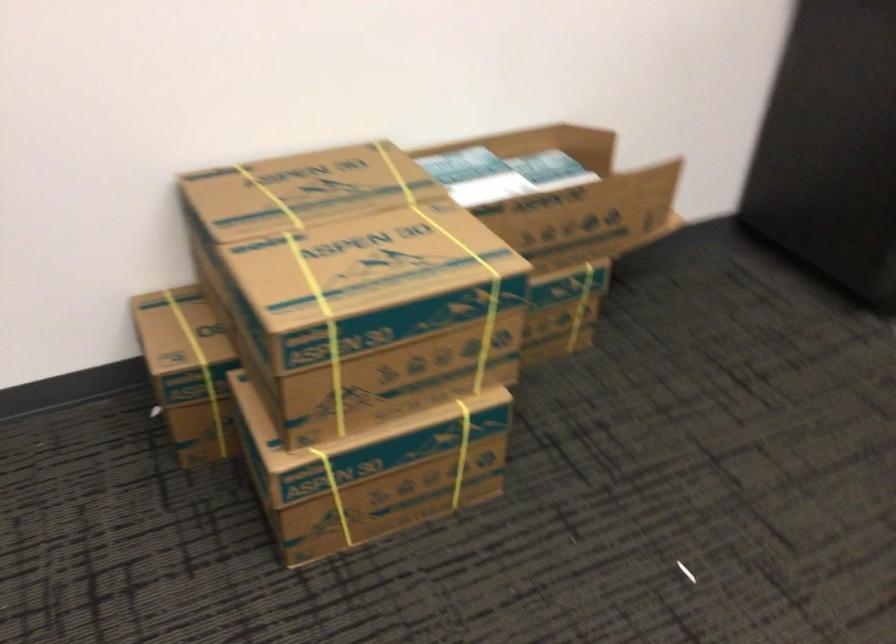
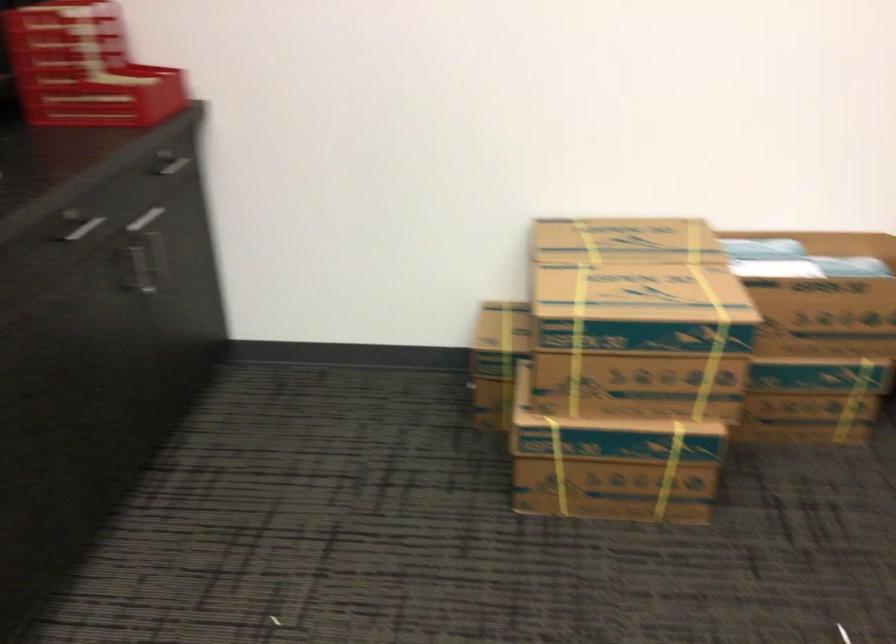
The point at (410,374) is marked in the first image. Where is the corresponding point in the second image?

(638, 386)